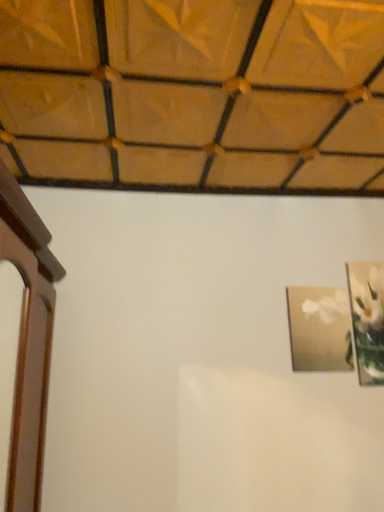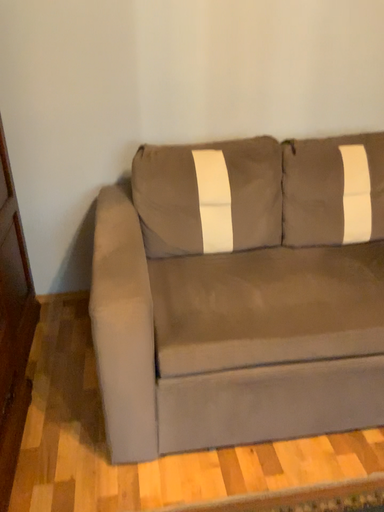
Question: How did the camera likely rotate when shooting the video?

Choices:
 (A) rotated upward
 (B) rotated downward

Answer: (B)